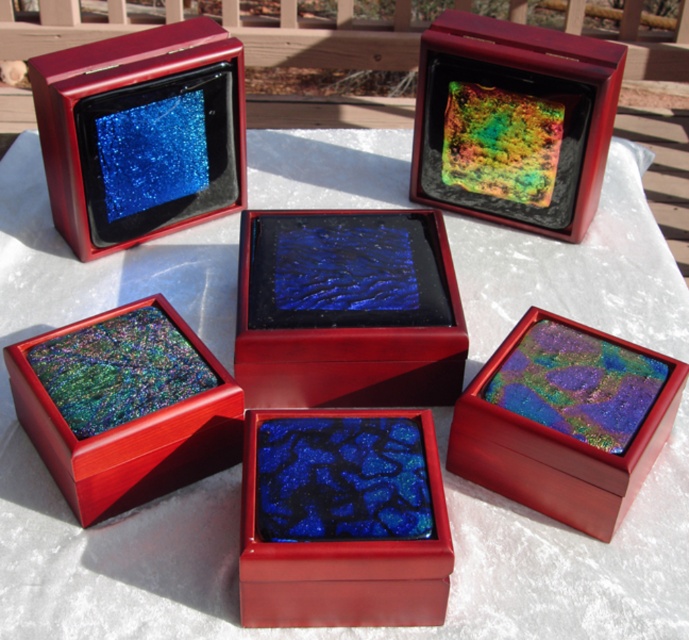
Question: Considering the real-world distances, which object is closest to the matte black box at upper left?

Choices:
 (A) multicolored glass mosaic at upper center
 (B) shiny purple glass box at center

Answer: (A)

Question: Can you confirm if glossy blue glass at center is positioned below iridescent glass box at center?

Choices:
 (A) no
 (B) yes

Answer: (A)

Question: Which is nearer to the multicolored glass mosaic at upper center?

Choices:
 (A) glossy blue stone at center
 (B) matte black box at upper left
 (C) shiny purple glass box at center

Answer: (C)

Question: Which of the following is the farthest from the observer?

Choices:
 (A) glossy blue glass at center
 (B) matte black box at upper left

Answer: (B)

Question: Does glossy blue stone at center have a greater width compared to iridescent glass box at center?

Choices:
 (A) no
 (B) yes

Answer: (A)

Question: Is matte black box at upper left to the right of multicolored glass mosaic at upper center from the viewer's perspective?

Choices:
 (A) yes
 (B) no

Answer: (B)